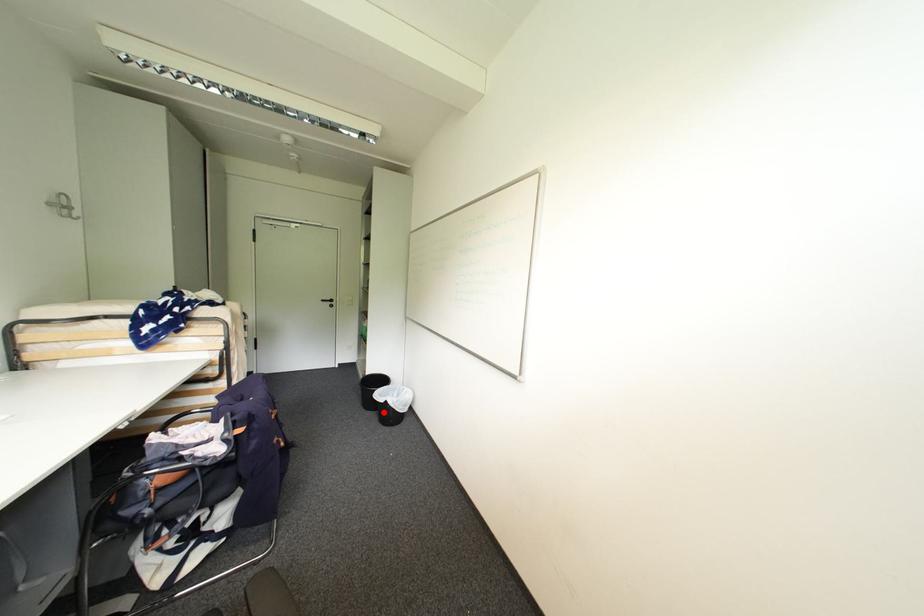
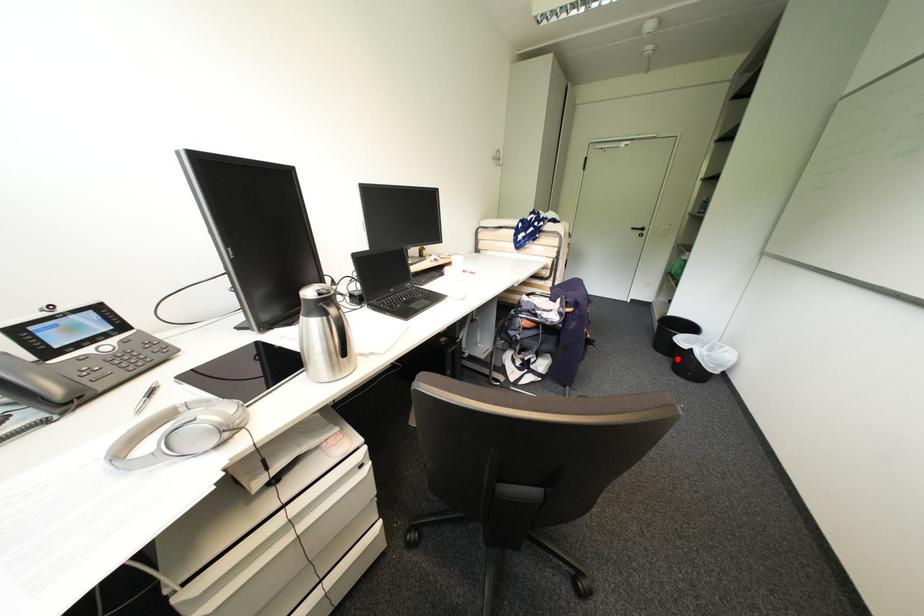
I am providing you with two images of the same scene from different viewpoints. A red point is marked on the first image and another point is marked on the second image. Does the point marked in image1 correspond to the same location as the one in image2?

Yes